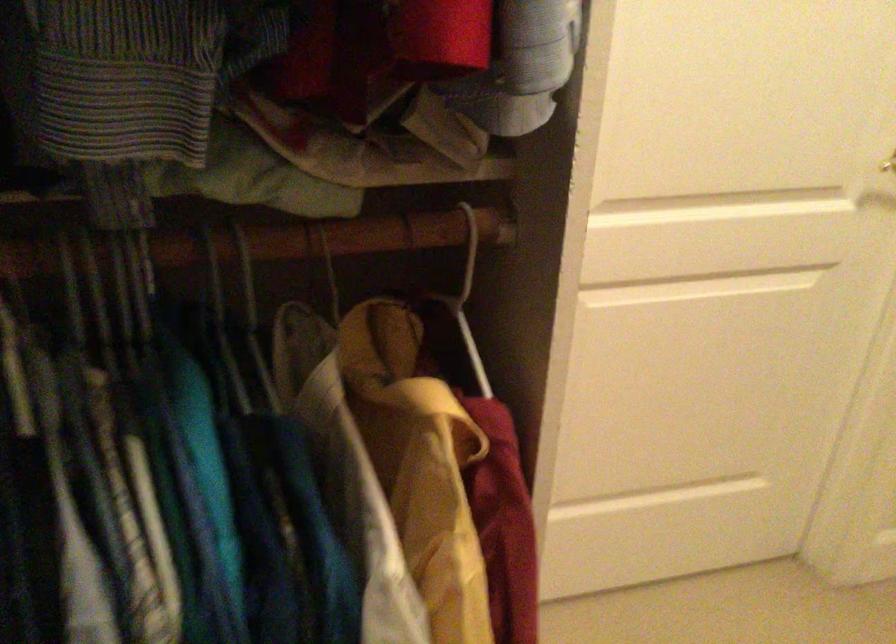
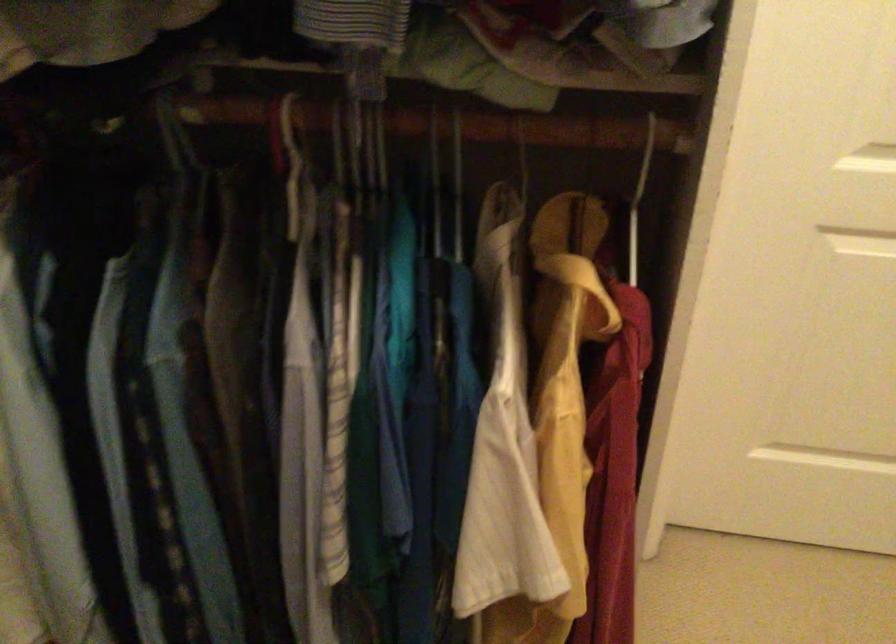
Question: The images are taken continuously from a first-person perspective. In which direction is your viewpoint rotating?

Choices:
 (A) Left
 (B) Right
 (C) Up
 (D) Down

Answer: (A)